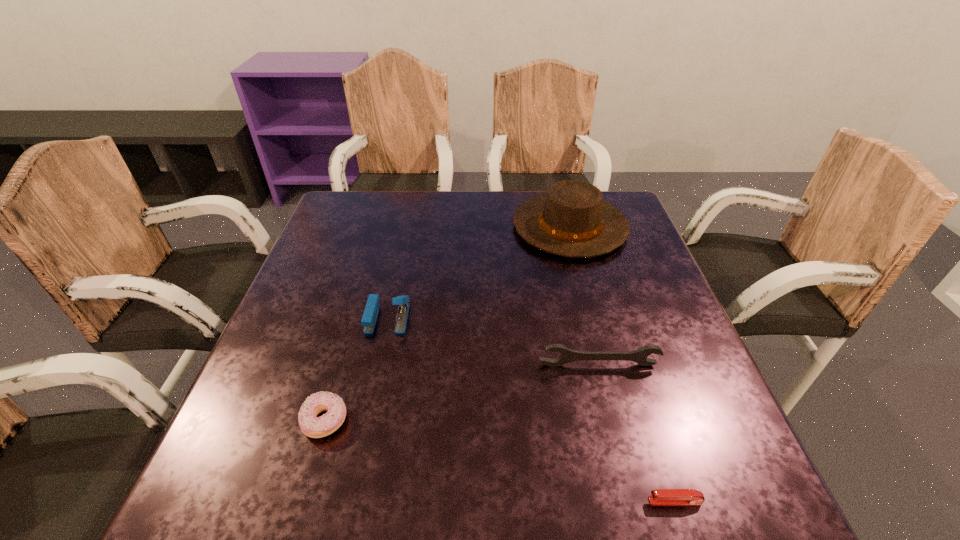
Identify the location of cowboy hat that is at the right edge. [x=572, y=220].

Locate an element on the screen. Image resolution: width=960 pixels, height=540 pixels. wrench situated at the right edge is located at coordinates (567, 355).

Locate an element on the screen. This screenshot has width=960, height=540. stapler at the right edge is located at coordinates (659, 496).

This screenshot has height=540, width=960. I want to click on object at the far right corner, so click(x=572, y=220).

Locate an element on the screen. Image resolution: width=960 pixels, height=540 pixels. object that is at the near right corner is located at coordinates (659, 496).

In the image, there is a desktop. Find the location of `vacant space at the far edge`. vacant space at the far edge is located at coordinates (382, 230).

You are a GUI agent. You are given a task and a screenshot of the screen. Output one action in this format:
    pyautogui.click(x=<x>, y=<y>)
    Task: Click on the vacant space at the near edge
    Image resolution: width=960 pixels, height=540 pixels.
    Given the screenshot: What is the action you would take?
    pyautogui.click(x=468, y=466)

Where is `free space at the left edge`? This screenshot has width=960, height=540. free space at the left edge is located at coordinates (347, 296).

The width and height of the screenshot is (960, 540). In the image, there is a desktop. What are the coordinates of `vacant space at the right edge` in the screenshot? It's located at (709, 462).

In the image, there is a desktop. Where is `free region at the far left corner`? The image size is (960, 540). free region at the far left corner is located at coordinates (349, 212).